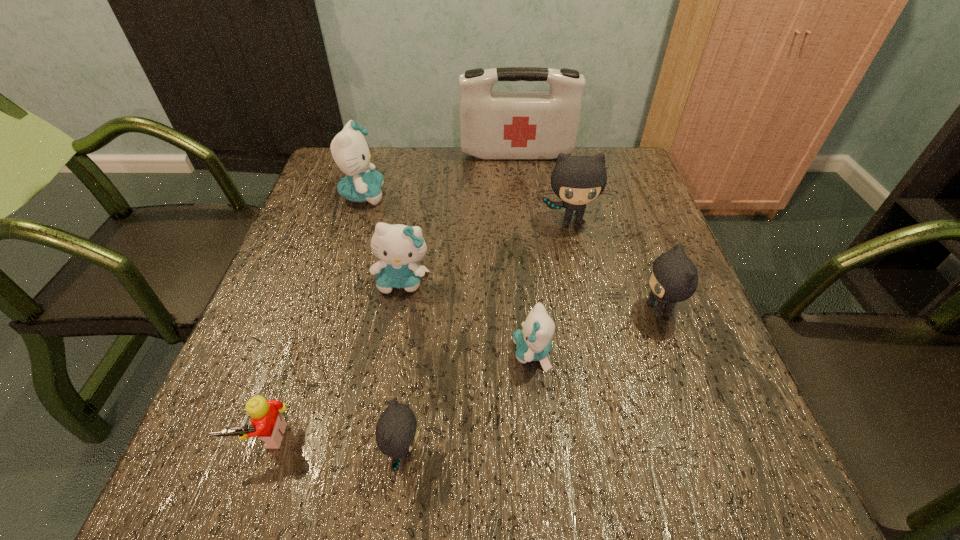
Where is `vacant region located 0.210m on the front-facing side of the second biggest gray kitten`? vacant region located 0.210m on the front-facing side of the second biggest gray kitten is located at coordinates (537, 310).

The width and height of the screenshot is (960, 540). Find the location of `vacant space located 0.400m on the front-facing side of the second biggest gray kitten`. vacant space located 0.400m on the front-facing side of the second biggest gray kitten is located at coordinates (444, 310).

The image size is (960, 540). Find the location of `free space located 0.220m on the face of the rightmost blue kitten`. free space located 0.220m on the face of the rightmost blue kitten is located at coordinates (396, 353).

Image resolution: width=960 pixels, height=540 pixels. I want to click on vacant area situated 0.050m on the face of the rightmost blue kitten, so click(487, 353).

Locate an element on the screen. This screenshot has height=540, width=960. vacant space located on the face of the rightmost blue kitten is located at coordinates (323, 353).

Identify the location of vacant space located 0.070m in front of the Lego with the accessory visible. This screenshot has height=540, width=960. (240, 507).

Locate an element on the screen. blank space located 0.120m on the front-facing side of the nearest gray kitten is located at coordinates (497, 451).

The width and height of the screenshot is (960, 540). I want to click on the first-aid kit present at the far edge, so click(493, 125).

In order to click on kitten that is positioned at the far edge in this screenshot , I will do pos(350,151).

Locate an element on the screen. Lego located in the near edge section of the desktop is located at coordinates (268, 424).